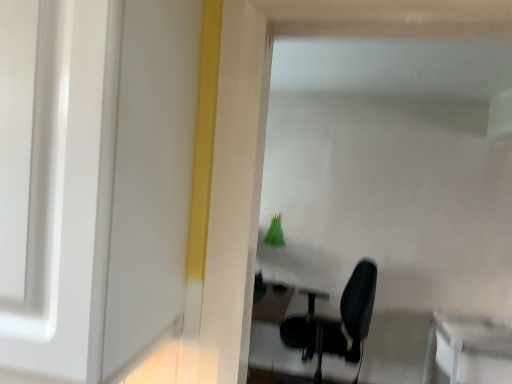
Question: Does white glossy table at lower right appear on the right side of black fabric chair at center?

Choices:
 (A) yes
 (B) no

Answer: (A)

Question: Is white glossy table at lower right next to black fabric chair at center and touching it?

Choices:
 (A) yes
 (B) no

Answer: (B)

Question: Is white glossy table at lower right positioned in front of black fabric chair at center?

Choices:
 (A) yes
 (B) no

Answer: (A)

Question: Would you say white glossy table at lower right is a long distance from black fabric chair at center?

Choices:
 (A) yes
 (B) no

Answer: (B)

Question: Is white glossy table at lower right oriented away from black fabric chair at center?

Choices:
 (A) no
 (B) yes

Answer: (A)

Question: Could you tell me if white glossy table at lower right is facing black fabric chair at center?

Choices:
 (A) yes
 (B) no

Answer: (B)

Question: Does black fabric chair at center have a lesser width compared to white glossy table at lower right?

Choices:
 (A) no
 (B) yes

Answer: (B)

Question: From the image's perspective, is black fabric chair at center located beneath white glossy table at lower right?

Choices:
 (A) no
 (B) yes

Answer: (A)

Question: Considering the relative sizes of black fabric chair at center and white glossy table at lower right in the image provided, is black fabric chair at center bigger than white glossy table at lower right?

Choices:
 (A) no
 (B) yes

Answer: (B)

Question: Can you confirm if black fabric chair at center is shorter than white glossy table at lower right?

Choices:
 (A) no
 (B) yes

Answer: (A)

Question: Can you confirm if black fabric chair at center is smaller than white glossy table at lower right?

Choices:
 (A) yes
 (B) no

Answer: (B)

Question: Is black fabric chair at center positioned behind white glossy table at lower right?

Choices:
 (A) yes
 (B) no

Answer: (A)

Question: In terms of size, does black fabric chair at center appear bigger or smaller than white glossy table at lower right?

Choices:
 (A) big
 (B) small

Answer: (A)